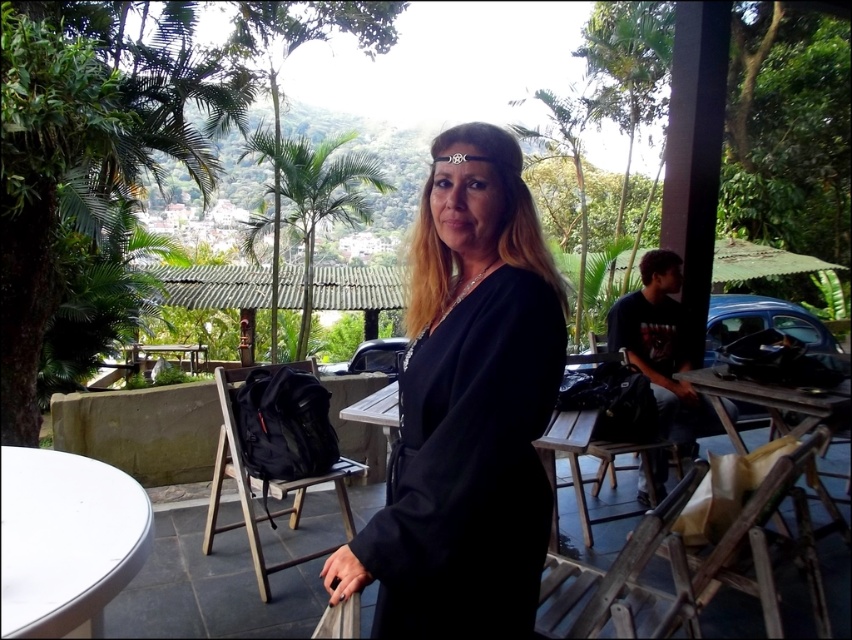
Which is above, wooden table at lower right or wooden chair at right?

Positioned higher is wooden table at lower right.

What do you see at coordinates (770, 403) in the screenshot? This screenshot has height=640, width=852. I see `wooden table at lower right` at bounding box center [770, 403].

Is point (833, 401) positioned after point (559, 424)?

That is True.

Locate an element on the screen. This screenshot has width=852, height=640. wooden table at lower right is located at coordinates (770, 403).

Can you confirm if black matte dress at center is positioned above wooden chair at lower center?

Yes, black matte dress at center is above wooden chair at lower center.

In the scene shown: Is black matte dress at center taller than wooden chair at lower center?

Correct, black matte dress at center is much taller as wooden chair at lower center.

Where is `black matte dress at center`? Image resolution: width=852 pixels, height=640 pixels. black matte dress at center is located at coordinates (467, 410).

Does white glossy table at lower left have a larger size compared to wooden chair at lower center?

Actually, white glossy table at lower left might be smaller than wooden chair at lower center.

Between white glossy table at lower left and wooden chair at lower center, which one appears on the left side from the viewer's perspective?

white glossy table at lower left is more to the left.

Between point (43, 556) and point (589, 577), which one is positioned behind?

Point (589, 577)

Find the location of a particular element. Image resolution: width=852 pixels, height=640 pixels. white glossy table at lower left is located at coordinates (66, 540).